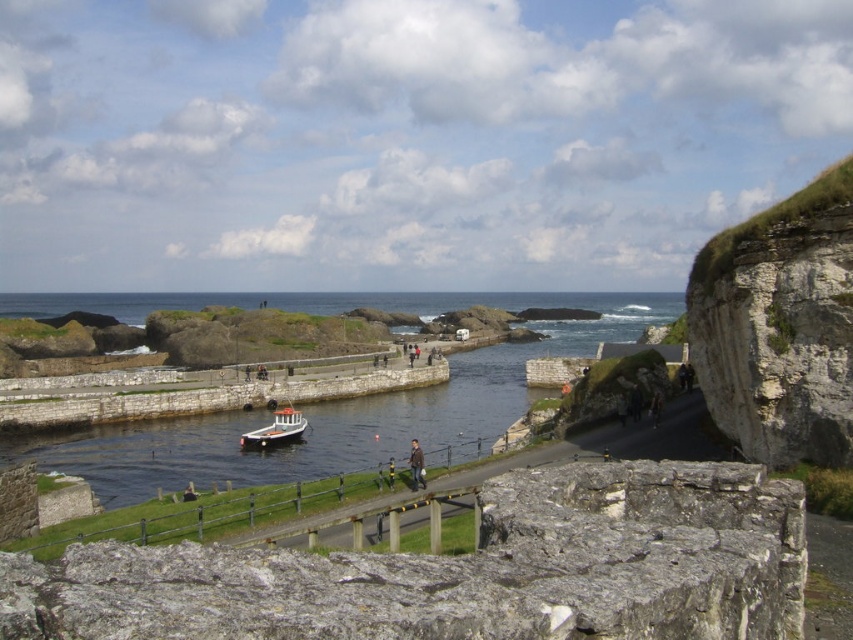
Does white wooden boat at center have a lesser width compared to brown leather jacket at center?

No.

Measure the distance from white wooden boat at center to brown leather jacket at center.

14.71 meters

Who is more distant from viewer, (254, 436) or (416, 445)?

The point (254, 436) is behind.

Where is `white wooden boat at center`? The width and height of the screenshot is (853, 640). white wooden boat at center is located at coordinates (276, 429).

Is gray rocky cliff at right further to camera compared to white wooden boat at center?

No.

Measure the distance between point (770, 428) and camera.

They are 119.10 feet apart.

Who is more forward, [793,323] or [299,429]?

Point [793,323] is in front.

Identify the location of gray rocky cliff at right. (780, 324).

How far apart are gray rocky cliff at right and brown leather jacket at center?

gray rocky cliff at right is 18.02 meters from brown leather jacket at center.

Does gray rocky cliff at right appear on the right side of brown leather jacket at center?

Yes, gray rocky cliff at right is to the right of brown leather jacket at center.

Does point (787, 330) come behind point (415, 458)?

No, it is in front of (415, 458).

Where is `gray rocky cliff at right`? The height and width of the screenshot is (640, 853). gray rocky cliff at right is located at coordinates (780, 324).